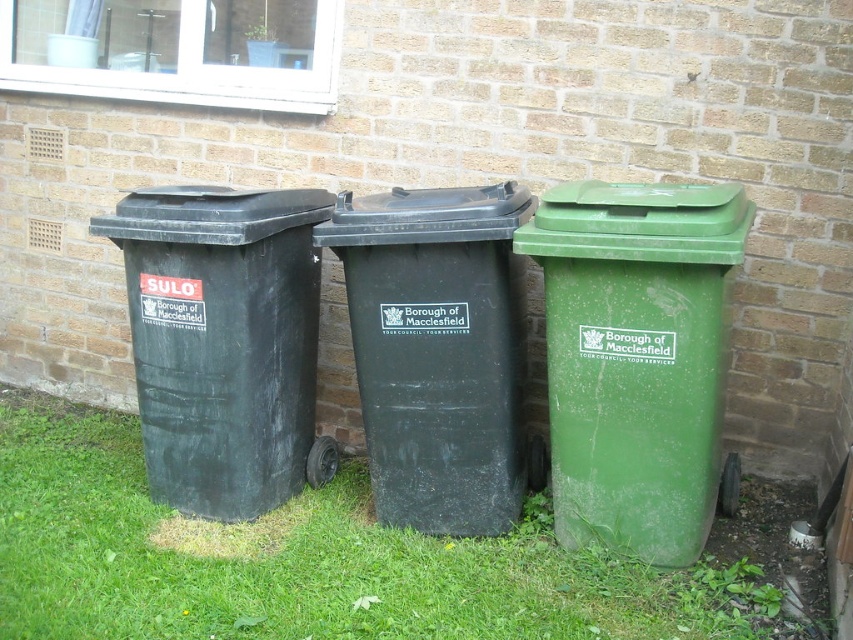
Consider the image. Which is more to the right, green grass at lower left or black plastic bin at center?

Positioned to the right is black plastic bin at center.

Who is taller, green grass at lower left or black plastic bin at center?

black plastic bin at center

Between point (432, 557) and point (473, 330), which one is positioned behind?

The point (432, 557) is more distant.

This screenshot has height=640, width=853. What are the coordinates of `green grass at lower left` in the screenshot? It's located at (343, 560).

Which is in front, point (396, 445) or point (701, 353)?

Positioned in front is point (701, 353).

Who is positioned more to the left, green plastic bin at center or green plastic recycling bin at right?

Positioned to the left is green plastic bin at center.

You are a GUI agent. You are given a task and a screenshot of the screen. Output one action in this format:
    pyautogui.click(x=<x>, y=<y>)
    Task: Click on the green plastic bin at center
    The width and height of the screenshot is (853, 640).
    Given the screenshot: What is the action you would take?
    pyautogui.click(x=563, y=344)

You are a GUI agent. You are given a task and a screenshot of the screen. Output one action in this format:
    pyautogui.click(x=<x>, y=<y>)
    Task: Click on the green plastic bin at center
    Image resolution: width=853 pixels, height=640 pixels.
    Given the screenshot: What is the action you would take?
    pyautogui.click(x=563, y=344)

Who is higher up, green grass at lower left or green plastic bin at center?

Positioned higher is green plastic bin at center.

This screenshot has height=640, width=853. Find the location of `green grass at lower left`. green grass at lower left is located at coordinates (343, 560).

You are a GUI agent. You are given a task and a screenshot of the screen. Output one action in this format:
    pyautogui.click(x=<x>, y=<y>)
    Task: Click on the green grass at lower left
    
    Given the screenshot: What is the action you would take?
    pyautogui.click(x=343, y=560)